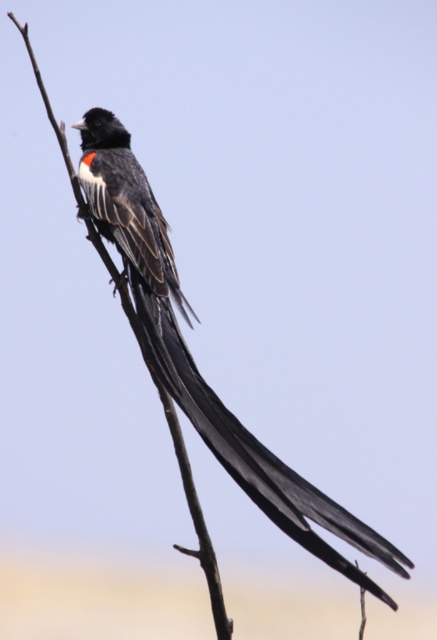
Question: Among these points, which one is farthest from the camera?

Choices:
 (A) [197, 524]
 (B) [173, 385]

Answer: (A)

Question: Does black feathered tail at center appear under brown wood tree branch at center?

Choices:
 (A) yes
 (B) no

Answer: (B)

Question: Does black feathered tail at center have a larger size compared to brown wood tree branch at center?

Choices:
 (A) no
 (B) yes

Answer: (B)

Question: Does black feathered tail at center come behind brown wood tree branch at center?

Choices:
 (A) no
 (B) yes

Answer: (A)